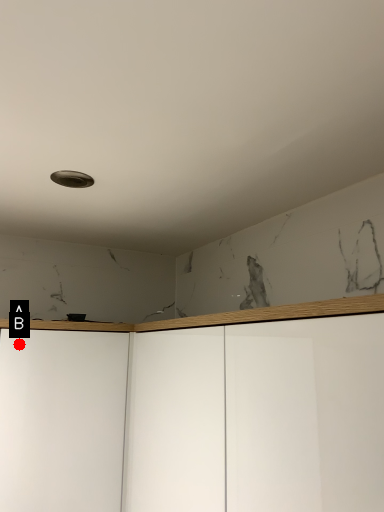
Question: Two points are circled on the image, labeled by A and B beside each circle. Which point is farther from the camera taking this photo?

Choices:
 (A) A is further
 (B) B is further

Answer: (A)